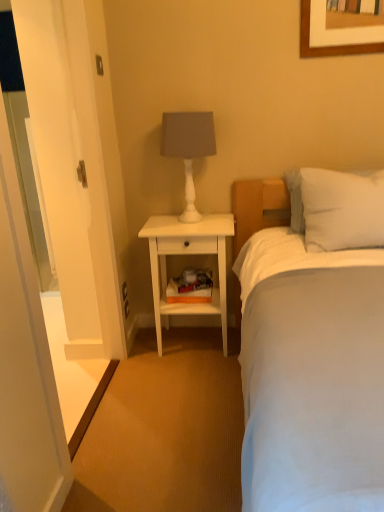
Question: Does white soft bed at center come in front of white glossy door at left?

Choices:
 (A) yes
 (B) no

Answer: (A)

Question: From a real-world perspective, is white soft bed at center below white glossy door at left?

Choices:
 (A) yes
 (B) no

Answer: (A)

Question: Is white soft bed at center far away from white glossy door at left?

Choices:
 (A) no
 (B) yes

Answer: (B)

Question: Is white soft bed at center located outside white glossy door at left?

Choices:
 (A) no
 (B) yes

Answer: (B)

Question: From the image's perspective, would you say white soft bed at center is shown under white glossy door at left?

Choices:
 (A) yes
 (B) no

Answer: (A)

Question: From a real-world perspective, is white soft bed at center physically above white glossy door at left?

Choices:
 (A) no
 (B) yes

Answer: (A)

Question: Is white soft pillow at upper right to the left of white wood nightstand at center from the viewer's perspective?

Choices:
 (A) no
 (B) yes

Answer: (A)

Question: From the image's perspective, is white soft pillow at upper right on top of white wood nightstand at center?

Choices:
 (A) yes
 (B) no

Answer: (A)

Question: Can you confirm if white soft pillow at upper right is shorter than white wood nightstand at center?

Choices:
 (A) yes
 (B) no

Answer: (A)

Question: From a real-world perspective, is white soft pillow at upper right under white wood nightstand at center?

Choices:
 (A) no
 (B) yes

Answer: (A)

Question: Does white soft pillow at upper right have a greater width compared to white wood nightstand at center?

Choices:
 (A) yes
 (B) no

Answer: (B)

Question: Is white soft pillow at upper right thinner than white wood nightstand at center?

Choices:
 (A) yes
 (B) no

Answer: (A)

Question: Does white soft pillow at upper right have a lesser width compared to white matte table lamp at upper center?

Choices:
 (A) yes
 (B) no

Answer: (B)